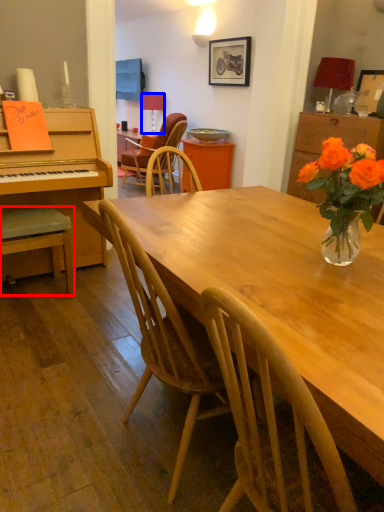
Question: Which object appears closest to the camera in this image, chair (highlighted by a red box) or lamp (highlighted by a blue box)?

Choices:
 (A) chair
 (B) lamp

Answer: (A)